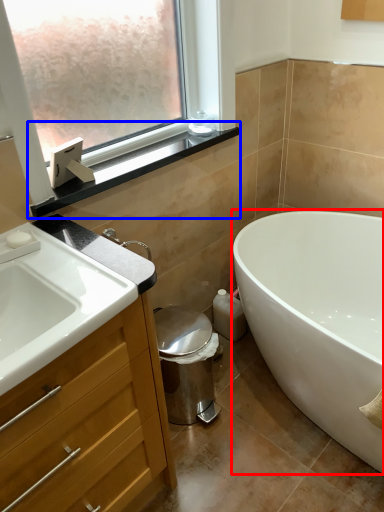
Question: Which of the following is the closest to the observer, bathtub (highlighted by a red box) or window sill (highlighted by a blue box)?

Choices:
 (A) bathtub
 (B) window sill

Answer: (A)